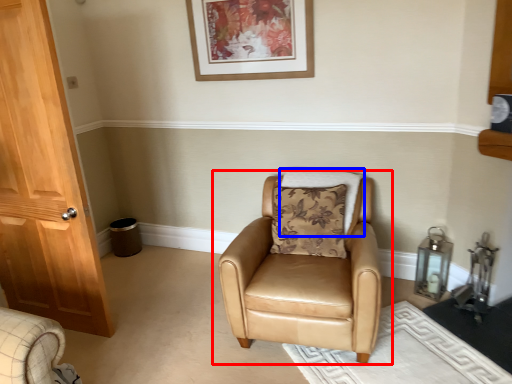
Question: Which object is further to the camera taking this photo, chair (highlighted by a red box) or pillow (highlighted by a blue box)?

Choices:
 (A) chair
 (B) pillow

Answer: (B)